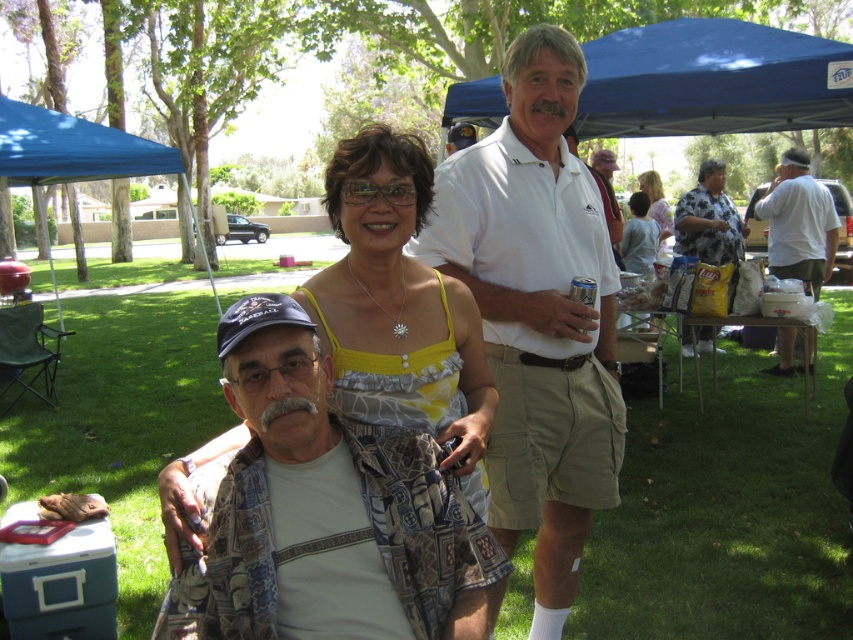
Does blue fabric canopy at upper left appear over matte yellow tank top at center?

No.

Where is `blue fabric canopy at upper left`? This screenshot has width=853, height=640. blue fabric canopy at upper left is located at coordinates (73, 148).

Which is behind, point (492, 433) or point (80, 132)?

Point (80, 132)

Which of these two, white cotton polo shirt at center or blue fabric canopy at upper left, stands shorter?

With less height is blue fabric canopy at upper left.

This screenshot has width=853, height=640. In order to click on white cotton polo shirt at center in this screenshot , I will do `click(537, 314)`.

Is point (759, 74) positioned after point (708, 234)?

No, it is not.

Between point (479, 106) and point (691, 225), which one is positioned in front?

Point (479, 106)

Locate an element on the screen. Image resolution: width=853 pixels, height=640 pixels. blue fabric canopy at upper center is located at coordinates (712, 81).